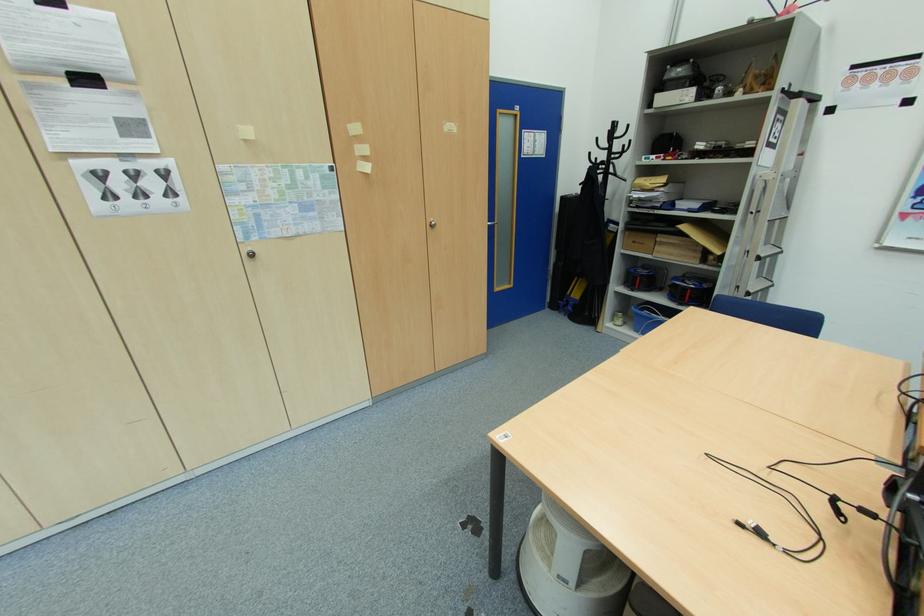
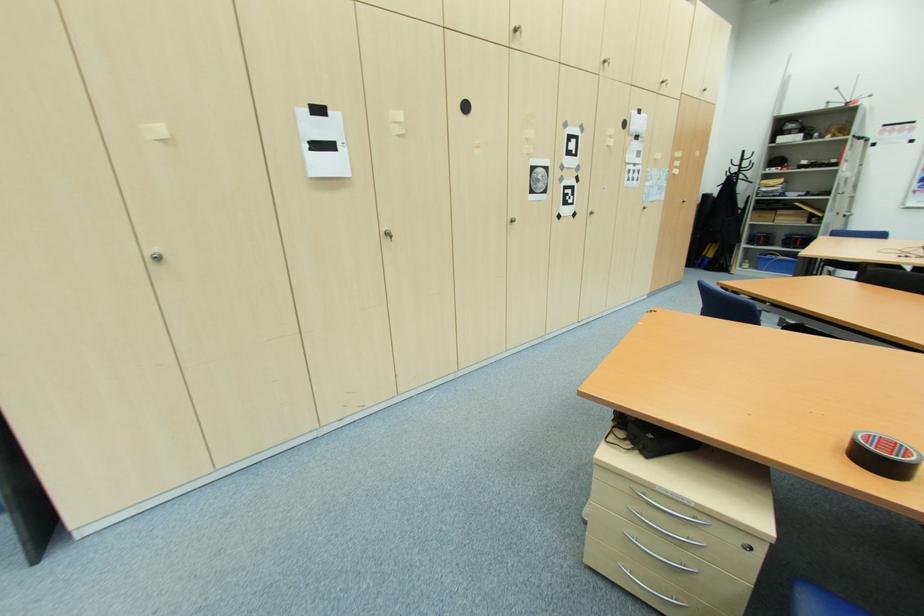
The images are taken continuously from a first-person perspective. In which direction are you moving?

The movement direction of the cameraman is left, backward.